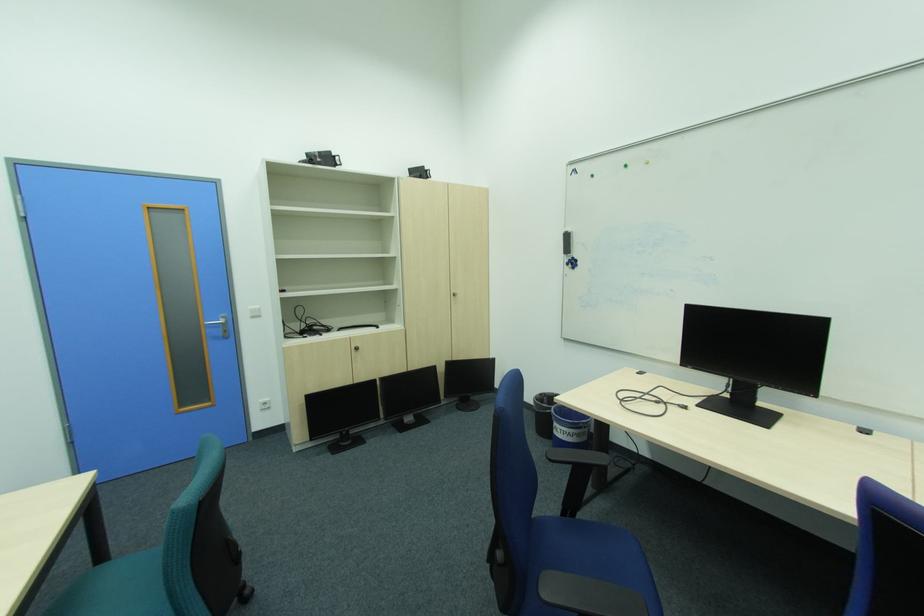
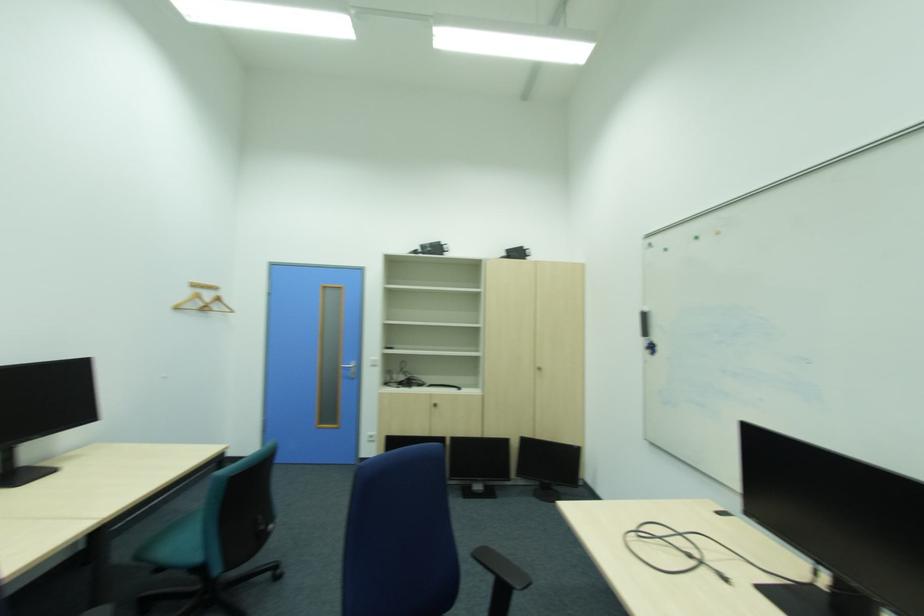
Question: How did the camera likely rotate?

Choices:
 (A) Left
 (B) Right
 (C) Up
 (D) Down

Answer: (A)